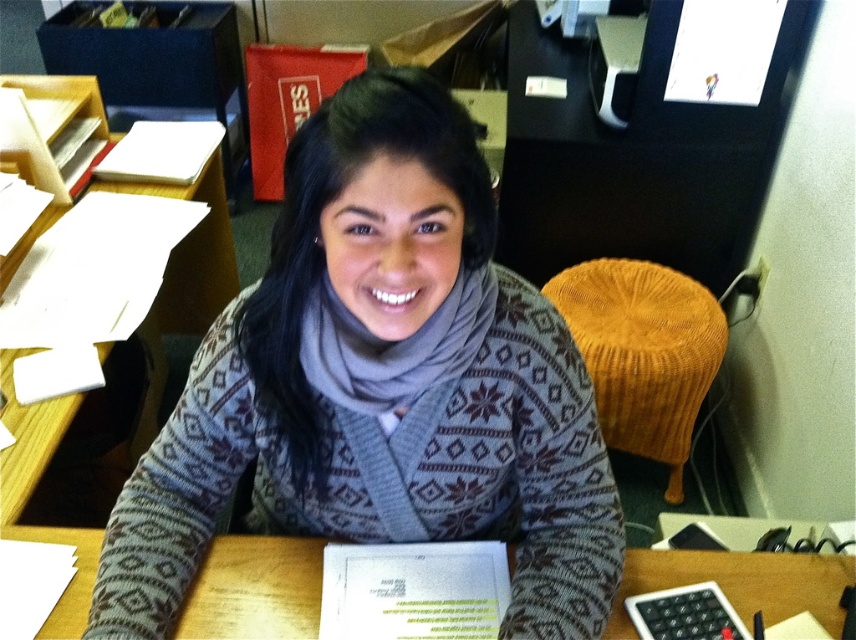
Is gray knitted sweater at center above wooden table at center?

Yes, gray knitted sweater at center is above wooden table at center.

The height and width of the screenshot is (640, 856). Describe the element at coordinates (388, 403) in the screenshot. I see `gray knitted sweater at center` at that location.

Between point (447, 385) and point (705, 556), which one is positioned behind?

The point (705, 556) is behind.

You are a GUI agent. You are given a task and a screenshot of the screen. Output one action in this format:
    pyautogui.click(x=<x>, y=<y>)
    Task: Click on the gray knitted sweater at center
    This screenshot has width=856, height=640.
    Given the screenshot: What is the action you would take?
    pyautogui.click(x=388, y=403)

Which is more to the left, wooden table at center or orange knitted stool at right?

From the viewer's perspective, wooden table at center appears more on the left side.

Between wooden table at center and orange knitted stool at right, which one has more height?

Standing taller between the two is orange knitted stool at right.

Which is in front, point (248, 620) or point (584, 298)?

Positioned in front is point (248, 620).

What are the coordinates of `wooden table at center` in the screenshot? It's located at (254, 589).

Between gray knitted sweater at center and orange knitted stool at right, which one is positioned lower?

orange knitted stool at right is lower down.

Does gray knitted sweater at center lie in front of orange knitted stool at right?

That is True.

Does point (257, 301) come closer to viewer compared to point (629, 339)?

Yes, point (257, 301) is closer to viewer.

The image size is (856, 640). Find the location of `gray knitted sweater at center`. gray knitted sweater at center is located at coordinates (388, 403).